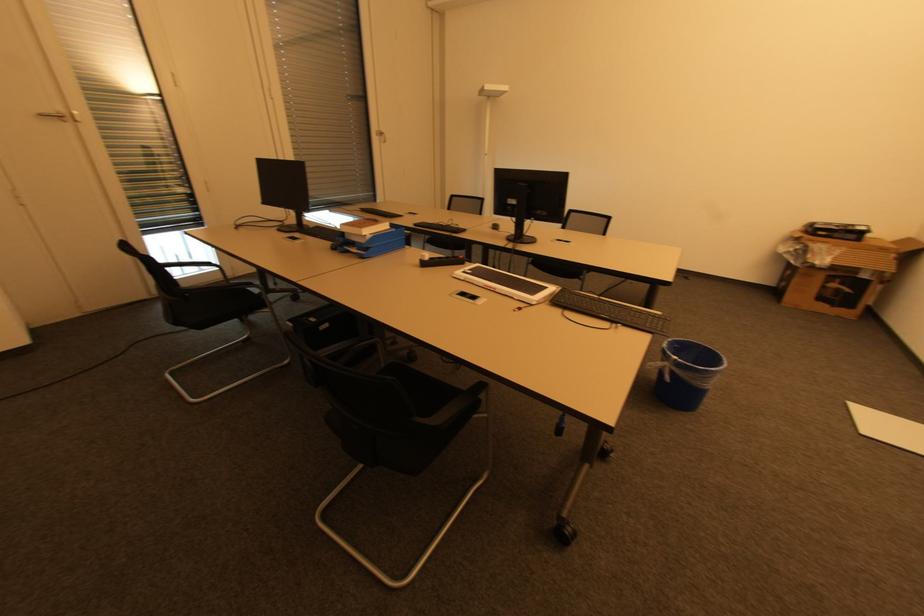
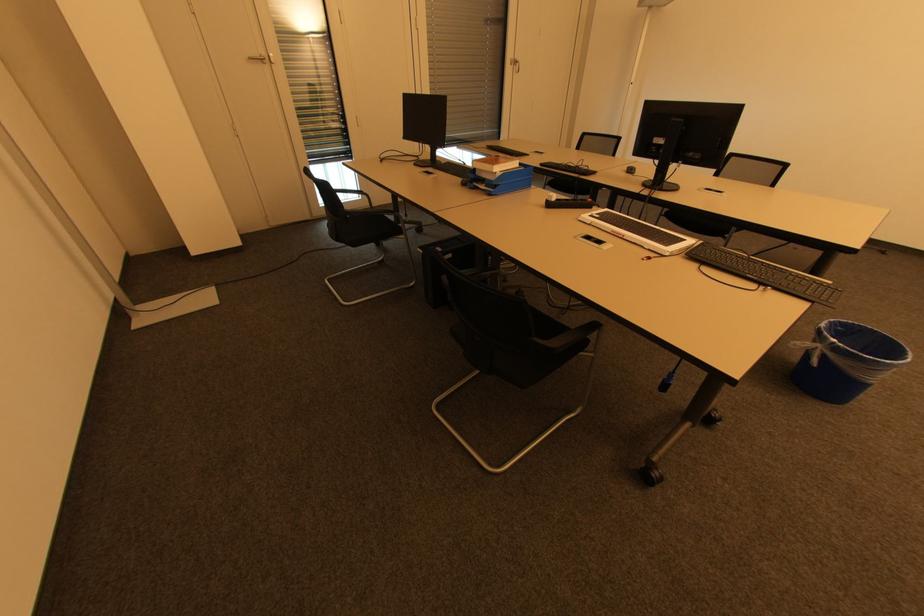
Where in the second image is the point corresponding to point (356, 251) from the first image?

(484, 187)